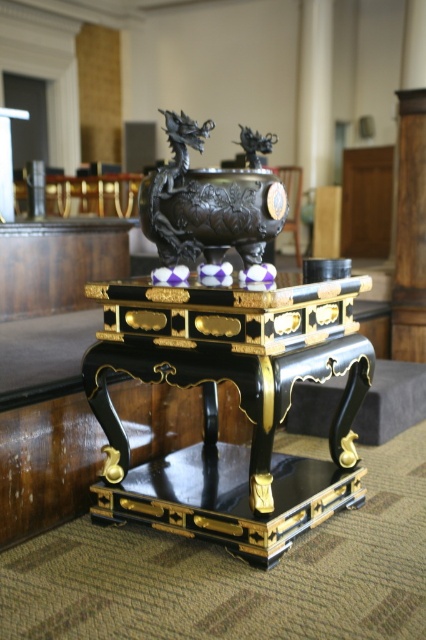
Question: Can you confirm if black lacquer table at center is thinner than black polished metal dragon at center?

Choices:
 (A) yes
 (B) no

Answer: (B)

Question: Which point is farther to the camera?

Choices:
 (A) black lacquer table at center
 (B) black polished metal dragon at center

Answer: (B)

Question: Does black lacquer table at center come in front of black polished metal dragon at center?

Choices:
 (A) yes
 (B) no

Answer: (A)

Question: Does black lacquer table at center lie in front of black polished metal dragon at center?

Choices:
 (A) yes
 (B) no

Answer: (A)